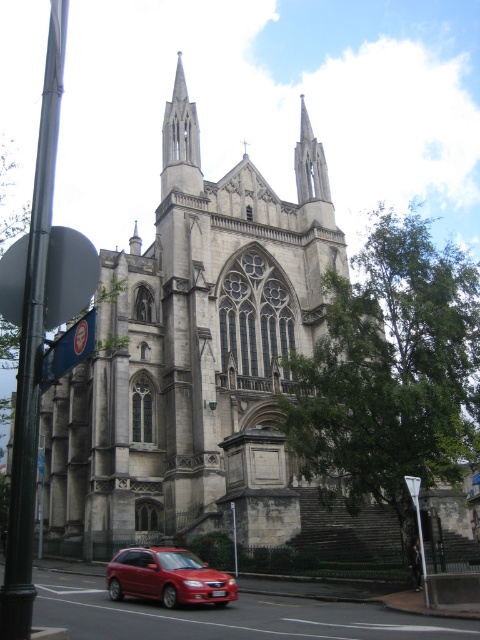
Question: Is shiny red sedan at lower center bigger than smooth stone spire at upper center?

Choices:
 (A) no
 (B) yes

Answer: (A)

Question: Is shiny red sedan at lower center further to the viewer compared to smooth stone spire at upper center?

Choices:
 (A) yes
 (B) no

Answer: (B)

Question: Which object is closer to the camera taking this photo?

Choices:
 (A) smooth stone spire at upper center
 (B) shiny red sedan at lower center

Answer: (B)

Question: Which point appears closest to the camera in this image?

Choices:
 (A) (213, 593)
 (B) (162, 193)

Answer: (A)

Question: Is shiny red sedan at lower center further to camera compared to smooth stone spire at upper center?

Choices:
 (A) no
 (B) yes

Answer: (A)